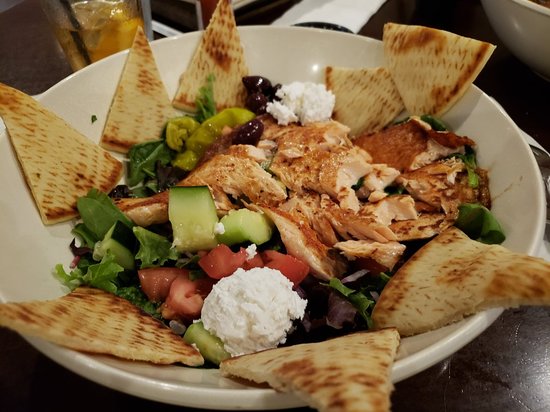
Find the location of a particular element. This screenshot has width=550, height=412. table is located at coordinates (496, 360).